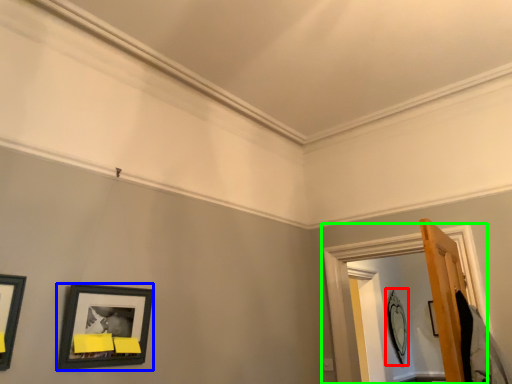
Question: Based on their relative distances, which object is nearer to picture frame (highlighted by a red box)? Choose from picture frame (highlighted by a blue box) and window frame (highlighted by a green box).

Choices:
 (A) picture frame
 (B) window frame

Answer: (B)